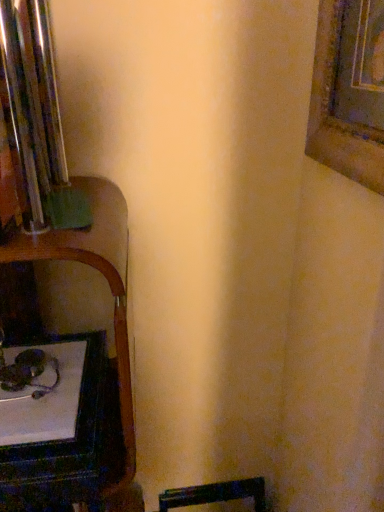
Question: Considering the positions of wooden picture frame at upper right and white glossy table at lower left in the image, is wooden picture frame at upper right taller or shorter than white glossy table at lower left?

Choices:
 (A) short
 (B) tall

Answer: (B)

Question: Considering the positions of wooden picture frame at upper right and white glossy table at lower left in the image, is wooden picture frame at upper right wider or thinner than white glossy table at lower left?

Choices:
 (A) wide
 (B) thin

Answer: (B)

Question: From the image's perspective, is wooden picture frame at upper right above or below white glossy table at lower left?

Choices:
 (A) below
 (B) above

Answer: (B)

Question: In terms of height, does white glossy table at lower left look taller or shorter compared to wooden picture frame at upper right?

Choices:
 (A) short
 (B) tall

Answer: (A)

Question: Considering the relative positions of white glossy table at lower left and wooden picture frame at upper right in the image provided, is white glossy table at lower left to the left or to the right of wooden picture frame at upper right?

Choices:
 (A) right
 (B) left

Answer: (B)

Question: From a real-world perspective, is white glossy table at lower left physically located above or below wooden picture frame at upper right?

Choices:
 (A) above
 (B) below

Answer: (B)

Question: Considering the positions of white glossy table at lower left and wooden picture frame at upper right in the image, is white glossy table at lower left wider or thinner than wooden picture frame at upper right?

Choices:
 (A) wide
 (B) thin

Answer: (A)